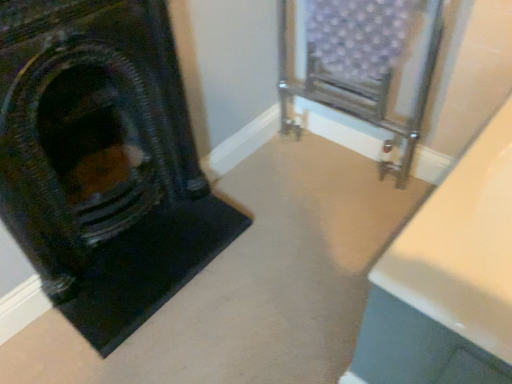
Find the location of a particular element. The image size is (512, 384). vacant space underneath metallic radiator at center (from a real-world perspective) is located at coordinates [x=338, y=149].